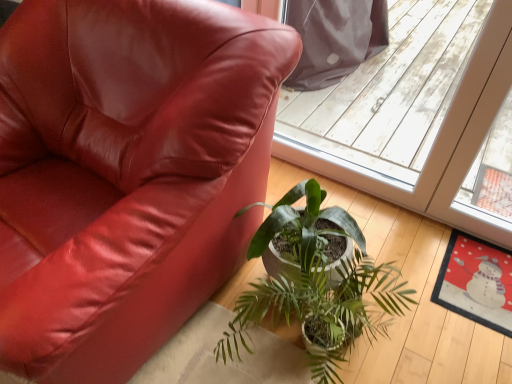
The width and height of the screenshot is (512, 384). What do you see at coordinates (417, 115) in the screenshot? I see `transparent plastic screen door at upper center` at bounding box center [417, 115].

What is the approximate width of green glossy plant at center?

It is 35.05 centimeters.

In order to click on transparent plastic screen door at upper center in this screenshot , I will do pos(417,115).

Which object is closer to the camera taking this photo, green glossy plant at center or matte leather chair at lower left?

matte leather chair at lower left is more forward.

In terms of size, does green glossy plant at center appear bigger or smaller than matte leather chair at lower left?

Considering their sizes, green glossy plant at center takes up less space than matte leather chair at lower left.

Which object is thinner, green glossy plant at center or matte leather chair at lower left?

green glossy plant at center is thinner.

In the scene shown: Is green glossy plant at center completely or partially outside of matte leather chair at lower left?

Yes, green glossy plant at center is not within matte leather chair at lower left.

From a real-world perspective, which object stands above the other?

In real-world perspective, matte leather chair at lower left is above.

Considering the positions of objects transparent plastic screen door at upper center and matte leather chair at lower left in the image provided, who is in front, transparent plastic screen door at upper center or matte leather chair at lower left?

Positioned in front is matte leather chair at lower left.

Is transparent plastic screen door at upper center turned away from matte leather chair at lower left?

No, matte leather chair at lower left is not at the back of transparent plastic screen door at upper center.

Is point (444, 149) positioned after point (205, 1)?

Yes, point (444, 149) is behind point (205, 1).

From a real-world perspective, which is physically below, matte leather chair at lower left or transparent plastic screen door at upper center?

transparent plastic screen door at upper center, from a real-world perspective.

Considering the sizes of matte leather chair at lower left and transparent plastic screen door at upper center in the image, is matte leather chair at lower left taller or shorter than transparent plastic screen door at upper center?

Clearly, matte leather chair at lower left is shorter compared to transparent plastic screen door at upper center.

Is matte leather chair at lower left facing away from transparent plastic screen door at upper center?

Yes, matte leather chair at lower left is positioned with its back facing transparent plastic screen door at upper center.

Based on the photo, from their relative heights in the image, would you say green glossy plant at center is taller or shorter than transparent plastic screen door at upper center?

green glossy plant at center is shorter than transparent plastic screen door at upper center.

Is point (300, 271) less distant than point (419, 85)?

Yes, point (300, 271) is closer to viewer.

From the image's perspective, is green glossy plant at center on top of transparent plastic screen door at upper center?

Incorrect, from the image's perspective, green glossy plant at center is lower than transparent plastic screen door at upper center.

From a real-world perspective, which object rests below the other?

green glossy plant at center.

Between matte leather chair at lower left and green glossy plant at center, which one has smaller width?

Thinner between the two is green glossy plant at center.

Is matte leather chair at lower left taller or shorter than green glossy plant at center?

Considering their sizes, matte leather chair at lower left has more height than green glossy plant at center.

From a real-world perspective, is matte leather chair at lower left physically below green glossy plant at center?

No, from a real-world perspective, matte leather chair at lower left is not beneath green glossy plant at center.

Between transparent plastic screen door at upper center and green glossy plant at center, which one has larger size?

Result: With larger size is green glossy plant at center.

Considering the relative sizes of transparent plastic screen door at upper center and green glossy plant at center in the image provided, is transparent plastic screen door at upper center thinner than green glossy plant at center?

Yes.

Which of these two, transparent plastic screen door at upper center or green glossy plant at center, stands shorter?

With less height is green glossy plant at center.

From the image's perspective, which one is positioned lower, transparent plastic screen door at upper center or green glossy plant at center?

green glossy plant at center is shown below in the image.

You are a GUI agent. You are given a task and a screenshot of the screen. Output one action in this format:
    pyautogui.click(x=<x>, y=<y>)
    Task: Click on the houseplant to the right of matte leather chair at lower left
    This screenshot has width=512, height=384.
    Given the screenshot: What is the action you would take?
    pyautogui.click(x=317, y=284)

Find the location of `screen door located above the matte leather chair at lower left (from the image's perspective)`. screen door located above the matte leather chair at lower left (from the image's perspective) is located at coordinates (417, 115).

When comparing their distances from green glossy plant at center, does transparent plastic screen door at upper center or matte leather chair at lower left seem further?

transparent plastic screen door at upper center is positioned further to the anchor green glossy plant at center.

Which object lies further to the anchor point transparent plastic screen door at upper center, green glossy plant at center or matte leather chair at lower left?

matte leather chair at lower left is further to transparent plastic screen door at upper center.

Looking at the image, which one is located closer to matte leather chair at lower left, green glossy plant at center or transparent plastic screen door at upper center?

Based on the image, green glossy plant at center appears to be nearer to matte leather chair at lower left.

Looking at this image, when comparing their distances from matte leather chair at lower left, does transparent plastic screen door at upper center or green glossy plant at center seem closer?

Among the two, green glossy plant at center is located nearer to matte leather chair at lower left.

Looking at the image, which one is located closer to transparent plastic screen door at upper center, matte leather chair at lower left or green glossy plant at center?

green glossy plant at center is closer to transparent plastic screen door at upper center.

Which object lies nearer to the anchor point green glossy plant at center, matte leather chair at lower left or transparent plastic screen door at upper center?

matte leather chair at lower left is positioned closer to the anchor green glossy plant at center.

This screenshot has height=384, width=512. In order to click on houseplant between matte leather chair at lower left and transparent plastic screen door at upper center from left to right in this screenshot , I will do click(317, 284).